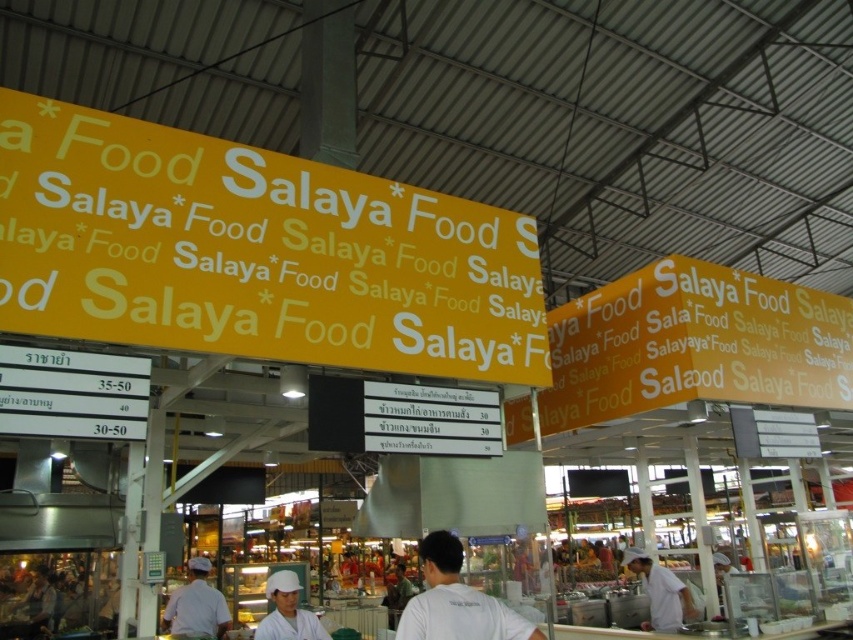
Question: Is yellow matte signboard at upper center wider than yellow fabric sign at upper center?

Choices:
 (A) no
 (B) yes

Answer: (A)

Question: Can you confirm if white uniform at center is positioned below white uniform at lower right?

Choices:
 (A) no
 (B) yes

Answer: (A)

Question: Among these objects, which one is nearest to the camera?

Choices:
 (A) yellow fabric sign at upper center
 (B) yellow matte signboard at upper center

Answer: (B)

Question: Can you confirm if white matte shirt at center is positioned below white matte chef hat at center?

Choices:
 (A) yes
 (B) no

Answer: (B)

Question: Which object is the farthest from the white uniform at lower right?

Choices:
 (A) white matte shirt at center
 (B) white uniform at center
 (C) yellow fabric sign at upper center

Answer: (B)

Question: Which object appears farthest from the camera in this image?

Choices:
 (A) yellow matte signboard at upper center
 (B) white uniform at lower right
 (C) white matte shirt at center

Answer: (B)